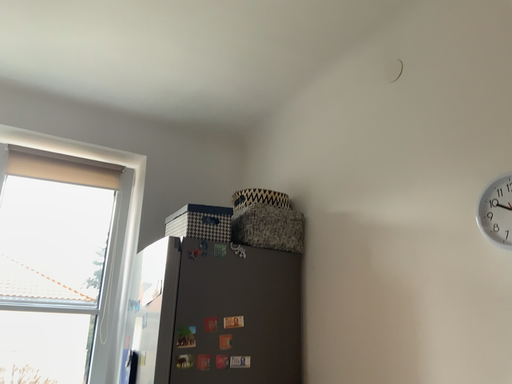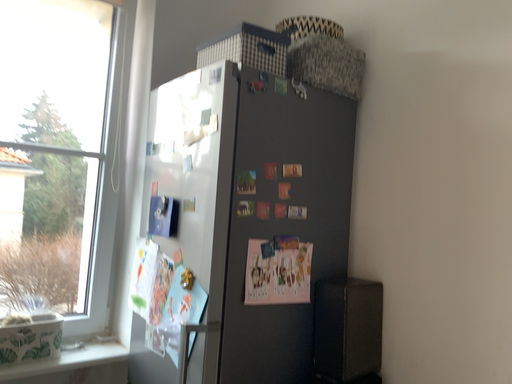
Question: How did the camera likely rotate when shooting the video?

Choices:
 (A) rotated upward
 (B) rotated downward

Answer: (B)